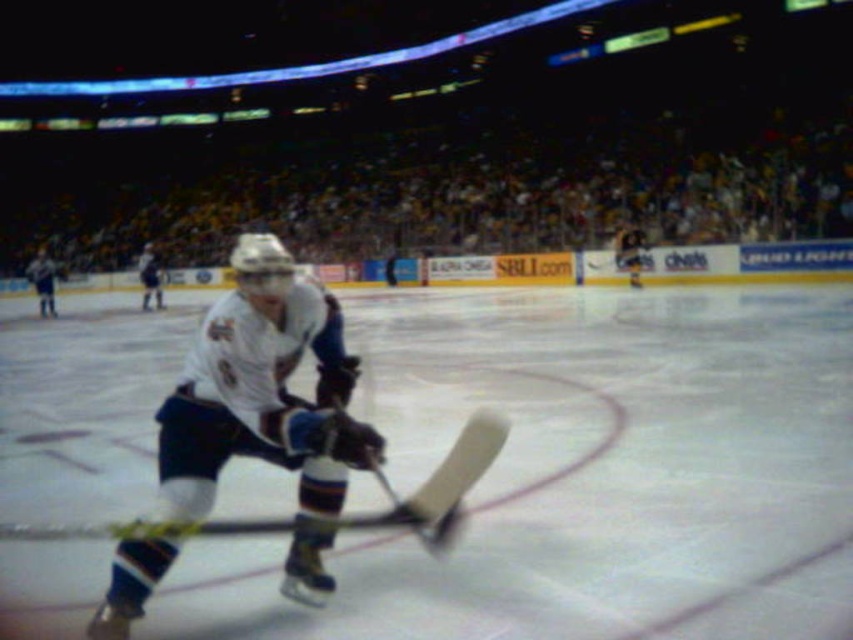
Between point (212, 480) and point (49, 285), which one is positioned behind?

The point (49, 285) is behind.

Can you confirm if white matte hockey stick at center is positioned above white jersey at left?

No.

Describe the element at coordinates (262, 388) in the screenshot. I see `white matte hockey stick at center` at that location.

At what (x,y) coordinates should I click in order to perform the action: click on white matte hockey stick at center. Please return your answer as a coordinate pair (x, y). This screenshot has height=640, width=853. Looking at the image, I should click on (262, 388).